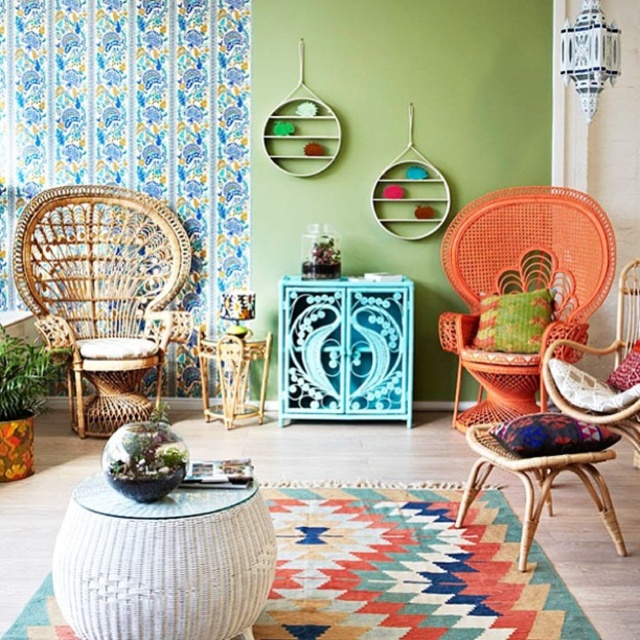
Question: Is blue and white floral fabric curtain at left to the left of rattan stool at center from the viewer's perspective?

Choices:
 (A) yes
 (B) no

Answer: (A)

Question: Can you confirm if blue and white floral fabric curtain at left is wider than rattan/wooden rocking chair at left?

Choices:
 (A) no
 (B) yes

Answer: (B)

Question: Which of the following is the farthest from the observer?

Choices:
 (A) blue and white floral fabric curtain at left
 (B) orange wicker chair at right

Answer: (A)

Question: Which point is farther to the camera?

Choices:
 (A) rattan/wooden rocking chair at left
 (B) green leafy plant at lower left
 (C) orange wicker chair at right

Answer: (A)

Question: Which point appears farthest from the camera in this image?

Choices:
 (A) (486, 422)
 (B) (522, 232)
 (C) (179, 308)

Answer: (C)

Question: Does blue and white floral fabric curtain at left appear over rattan/wooden rocking chair at left?

Choices:
 (A) no
 (B) yes

Answer: (B)